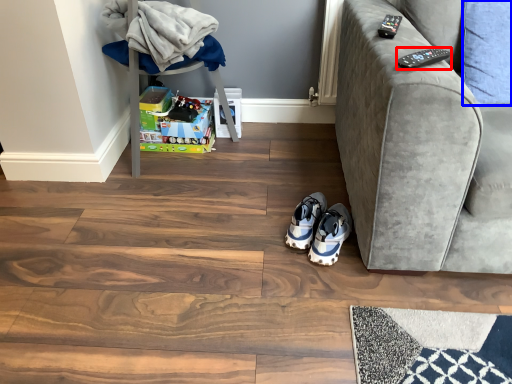
Question: Which of the following is the closest to the observer, remote (highlighted by a red box) or pillow (highlighted by a blue box)?

Choices:
 (A) remote
 (B) pillow

Answer: (A)